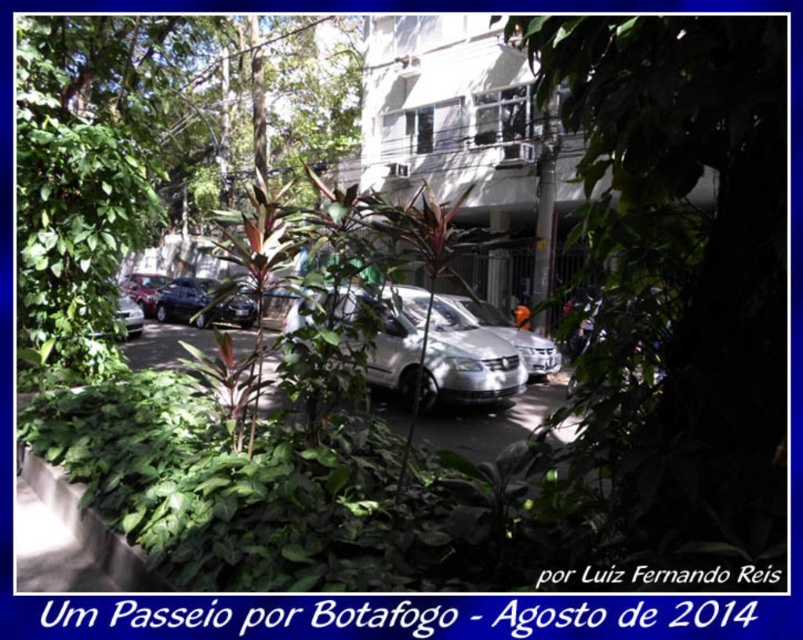
Is satin metallic car at center to the left of shiny metallic car at center from the viewer's perspective?

No, satin metallic car at center is not to the left of shiny metallic car at center.

I want to click on satin metallic car at center, so click(496, 332).

Find the location of a particular element. This screenshot has width=803, height=640. satin metallic car at center is located at coordinates (496, 332).

Who is taller, green leafy plant at center or shiny metallic car at center?

green leafy plant at center is taller.

Can you confirm if green leafy plant at center is positioned below shiny metallic car at center?

Actually, green leafy plant at center is above shiny metallic car at center.

Where is `green leafy plant at center`? This screenshot has width=803, height=640. green leafy plant at center is located at coordinates (149, 148).

Can you confirm if satin black car at center is smaller than shiny metallic car at center?

Indeed, satin black car at center has a smaller size compared to shiny metallic car at center.

Based on the photo, who is positioned more to the left, satin black car at center or shiny metallic car at center?

shiny metallic car at center

Locate an element on the screen. The height and width of the screenshot is (640, 803). satin black car at center is located at coordinates (202, 304).